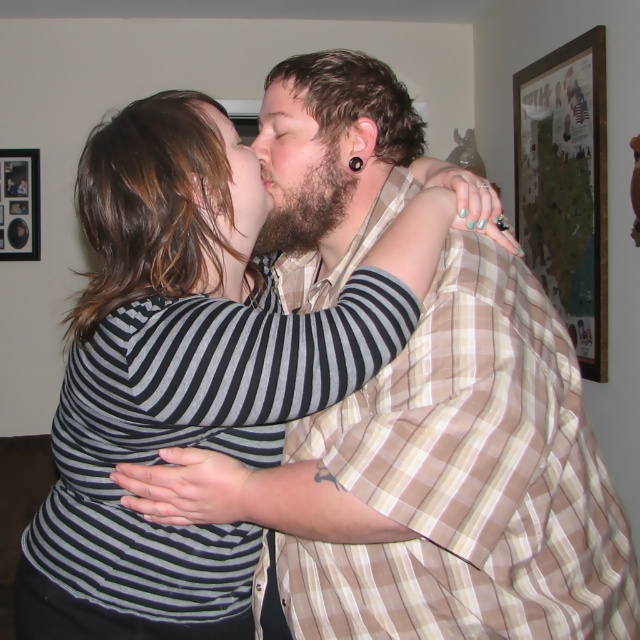
Is the position of striped fabric shirt at center less distant than that of bearded man at center?

Yes, striped fabric shirt at center is in front of bearded man at center.

Looking at this image, is striped fabric shirt at center thinner than bearded man at center?

In fact, striped fabric shirt at center might be wider than bearded man at center.

The height and width of the screenshot is (640, 640). I want to click on striped fabric shirt at center, so click(x=188, y=376).

Which is in front, point (218, 221) or point (8, 184)?

Point (218, 221) is more forward.

Is beige plaid shirt at center behind wooden picture frame at upper left?

That is False.

Who is more forward, (241, 145) or (26, 198)?

Positioned in front is point (241, 145).

Where is `beige plaid shirt at center`? beige plaid shirt at center is located at coordinates (241, 188).

Which is more to the left, striped fabric shirt at center or wooden framed map at upper right?

From the viewer's perspective, striped fabric shirt at center appears more on the left side.

The width and height of the screenshot is (640, 640). Describe the element at coordinates (188, 376) in the screenshot. I see `striped fabric shirt at center` at that location.

Find the location of a particular element. striped fabric shirt at center is located at coordinates (188, 376).